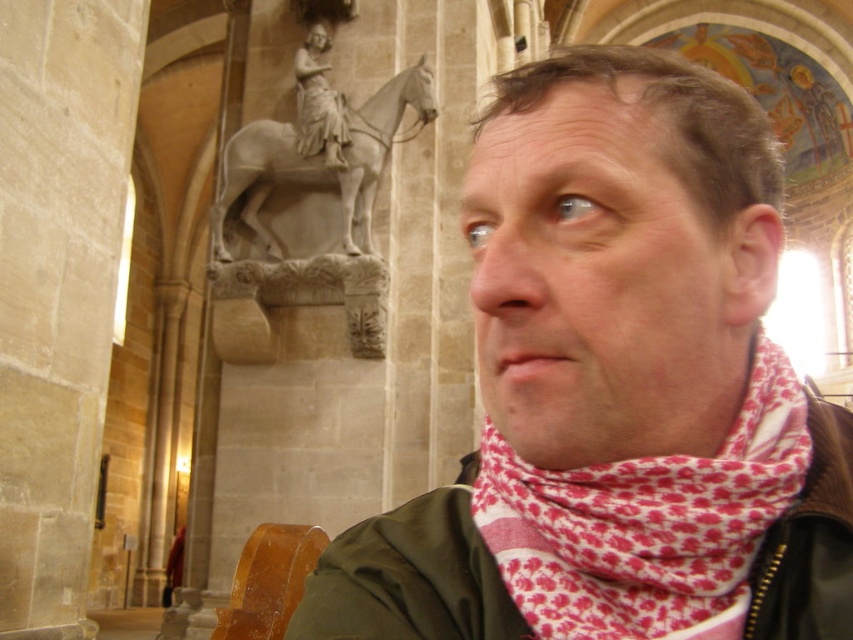
From the picture: Can you confirm if pink printed scarf at center is shorter than wooden chair at lower left?

No.

In the scene shown: Is pink printed scarf at center positioned before wooden chair at lower left?

Yes.

Where is `pink printed scarf at center`? The image size is (853, 640). pink printed scarf at center is located at coordinates (618, 387).

Is white marble statue at upper center above wooden chair at lower left?

Yes, white marble statue at upper center is above wooden chair at lower left.

Measure the distance between point [274,170] and camera.

Point [274,170] is 126.28 feet away from camera.

Is point (286, 129) less distant than point (310, 532)?

No, it is not.

Find the location of a particular element. white marble statue at upper center is located at coordinates (317, 154).

Which is below, pink printed scarf at right or gray stone statue at upper center?

Positioned lower is pink printed scarf at right.

Who is more forward, (692, 552) or (300, 116)?

Point (692, 552) is in front.

Is point (604, 632) positioned behind point (305, 102)?

No, it is in front of (305, 102).

Find the location of a particular element. pink printed scarf at right is located at coordinates [646, 524].